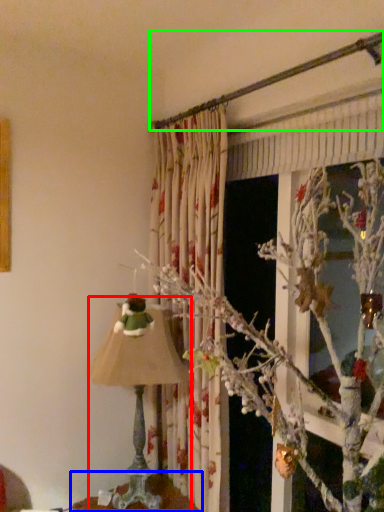
Question: Estimate the real-world distances between objects in this image. Which object is closer to lamp (highlighted by a red box), furniture (highlighted by a blue box) or branch (highlighted by a green box)?

Choices:
 (A) furniture
 (B) branch

Answer: (A)